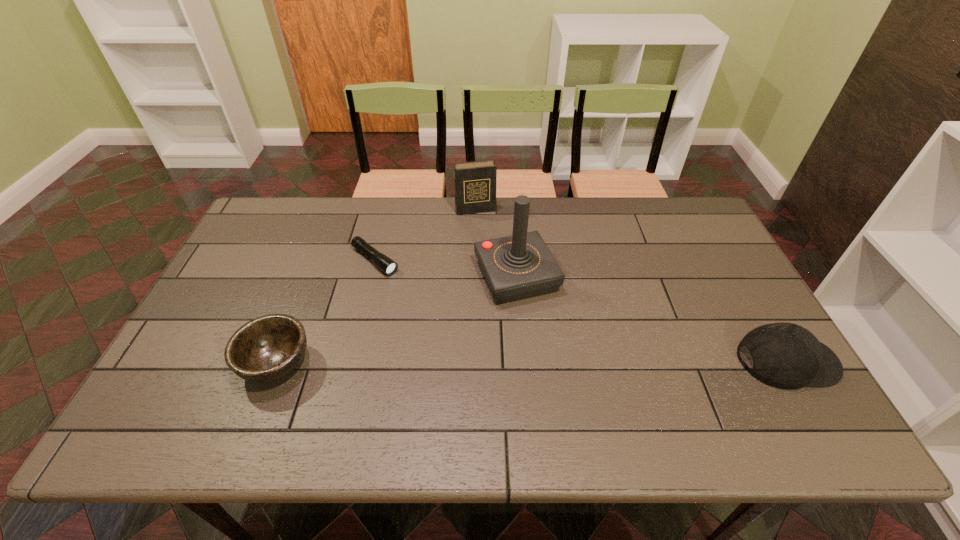
Find the location of a particular element. the leftmost object is located at coordinates (267, 348).

The width and height of the screenshot is (960, 540). I want to click on bowl, so click(x=267, y=348).

I want to click on cap, so click(785, 355).

At what (x,y) coordinates should I click in order to perform the action: click on the third shortest object. Please return your answer as a coordinate pair (x, y). This screenshot has width=960, height=540. Looking at the image, I should click on (785, 355).

Locate an element on the screen. flashlight is located at coordinates (388, 266).

Locate an element on the screen. Image resolution: width=960 pixels, height=540 pixels. the second object from left to right is located at coordinates (x=388, y=266).

The width and height of the screenshot is (960, 540). In order to click on the tallest object in this screenshot , I will do `click(520, 266)`.

I want to click on the fourth shortest object, so point(474,182).

At what (x,y) coordinates should I click in order to perform the action: click on diary. Please return your answer as a coordinate pair (x, y). Looking at the image, I should click on (474, 182).

Locate an element on the screen. free space located 0.260m on the right of the leftmost object is located at coordinates (418, 363).